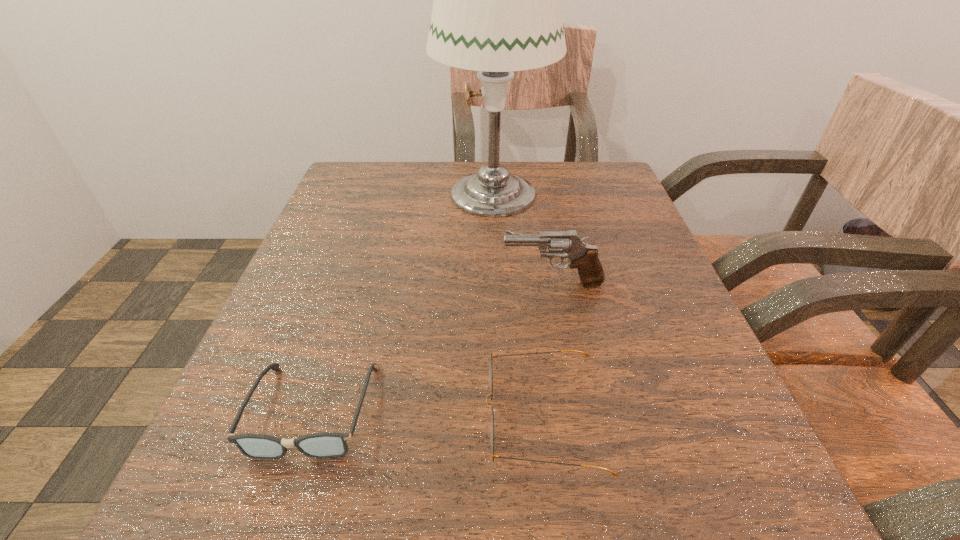
Identify the location of vacant space that's between the lampshade and the left spectacles. (403, 301).

Where is `free space between the third tallest object and the pistol`? free space between the third tallest object and the pistol is located at coordinates (x=548, y=350).

The image size is (960, 540). Identify the location of empty space between the shortest object and the third shortest object. (433, 347).

Identify the location of vacant area that lies between the third tallest object and the shortest object. (428, 414).

Identify the location of free space that is in between the third tallest object and the farthest object. (518, 305).

You are a GUI agent. You are given a task and a screenshot of the screen. Output one action in this format:
    pyautogui.click(x=<x>, y=<y>)
    Task: Click on the vacant space that is in between the farthest object and the third tallest object
    
    Given the screenshot: What is the action you would take?
    pyautogui.click(x=518, y=305)

Locate which object is the second closest to the shorter spectacles. Please provide its 2D coordinates. Your answer should be formatted as a tuple, i.e. [(x, y)], where the tuple contains the x and y coordinates of a point satisfying the conditions above.

[(565, 244)]

Where is `the second closest object to the third shortest object`? the second closest object to the third shortest object is located at coordinates (497, 9).

This screenshot has width=960, height=540. Find the location of `vacant region that satisfies the following two spatial constraints: 1. on the lampshade of the tallest object; 2. on the face of the leftmost object`. vacant region that satisfies the following two spatial constraints: 1. on the lampshade of the tallest object; 2. on the face of the leftmost object is located at coordinates (502, 410).

This screenshot has width=960, height=540. In order to click on free space that satisfies the following two spatial constraints: 1. at the barrel of the third shortest object; 2. on the face of the leftmost object in this screenshot , I will do `click(576, 410)`.